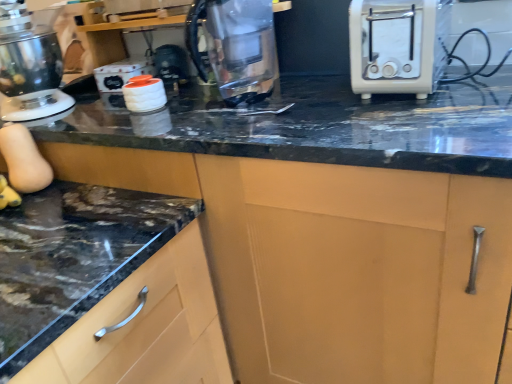
Question: Considering the positions of white plastic toaster at right and metallic silver stand mixer at left in the image, is white plastic toaster at right taller or shorter than metallic silver stand mixer at left?

Choices:
 (A) short
 (B) tall

Answer: (A)

Question: Considering the positions of white plastic toaster at right and metallic silver stand mixer at left in the image, is white plastic toaster at right bigger or smaller than metallic silver stand mixer at left?

Choices:
 (A) small
 (B) big

Answer: (A)

Question: Estimate the real-world distances between objects in this image. Which object is closer to the white glossy canisters at upper center?

Choices:
 (A) matte wood cabinet at lower left
 (B) transparent glass kettle at center
 (C) white plastic toaster at right
 (D) metallic silver stand mixer at left

Answer: (D)

Question: Which object is the farthest from the white plastic toaster at right?

Choices:
 (A) transparent glass kettle at center
 (B) metallic silver stand mixer at left
 (C) white glossy canisters at upper center
 (D) matte wood cabinet at lower left

Answer: (B)